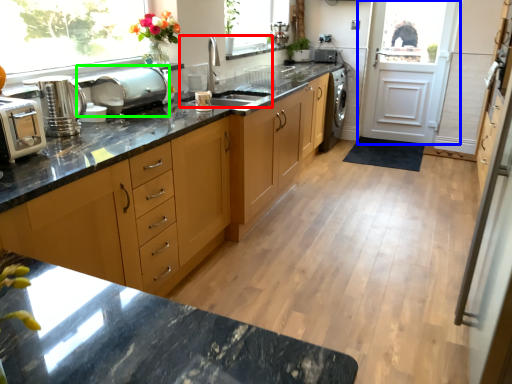
Question: Which object is the farthest from sink (highlighted by a red box)? Choose among these: door (highlighted by a blue box) or appliance (highlighted by a green box).

Choices:
 (A) door
 (B) appliance

Answer: (A)